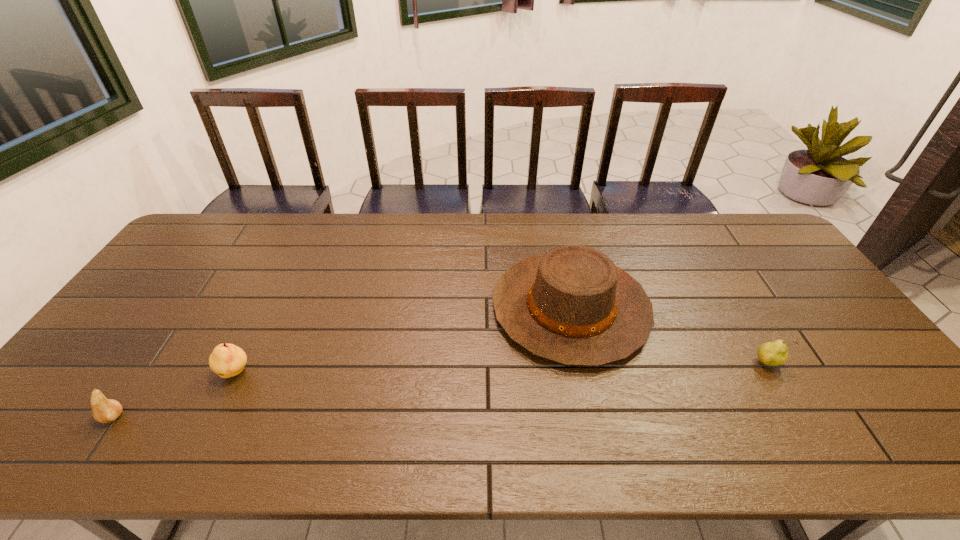
I want to click on the third object from left to right, so click(x=572, y=306).

Find the location of a particular element. Image resolution: width=960 pixels, height=540 pixels. the tallest object is located at coordinates (572, 306).

I want to click on the second pear from left to right, so click(227, 360).

Image resolution: width=960 pixels, height=540 pixels. Identify the location of the rightmost object. (775, 353).

Identify the location of the leftmost object. Image resolution: width=960 pixels, height=540 pixels. (104, 410).

What are the coordinates of `the nearest object` in the screenshot? It's located at (104, 410).

The height and width of the screenshot is (540, 960). In order to click on vacant space located on the left of the cowboy hat in this screenshot , I will do `click(414, 308)`.

The image size is (960, 540). What are the coordinates of `free spot located on the right of the third object from right to left` in the screenshot? It's located at (394, 373).

What are the coordinates of `vacant position located on the right of the rightmost pear` in the screenshot? It's located at (823, 363).

This screenshot has width=960, height=540. I want to click on free space located 0.140m on the back of the leftmost pear, so click(x=153, y=359).